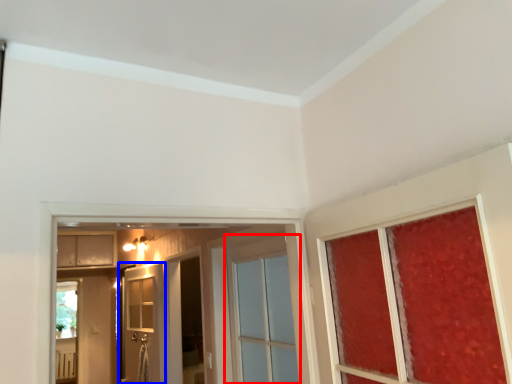
Question: Among these objects, which one is nearest to the camera, door (highlighted by a red box) or door (highlighted by a blue box)?

Choices:
 (A) door
 (B) door

Answer: (A)